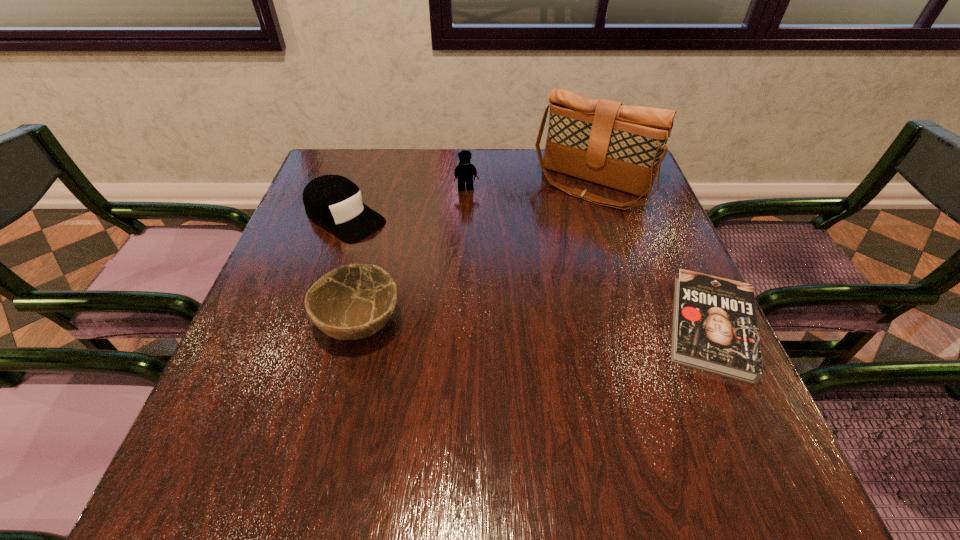
In the image, there is a desktop. Identify the location of vacant space at the left edge. This screenshot has height=540, width=960. (301, 318).

The image size is (960, 540). Find the location of `vacant space at the right edge`. vacant space at the right edge is located at coordinates (640, 225).

Image resolution: width=960 pixels, height=540 pixels. I want to click on free space at the far left corner of the desktop, so click(x=344, y=165).

In the image, there is a desktop. Where is `free region at the near left corner`? free region at the near left corner is located at coordinates (276, 424).

In the image, there is a desktop. At what (x,y) coordinates should I click in order to perform the action: click on blank space at the far right corner. Please return your answer as a coordinate pair (x, y). This screenshot has height=540, width=960. Looking at the image, I should click on (603, 195).

I want to click on unoccupied area between the third object from left to right and the book, so click(588, 258).

You are a GUI agent. You are given a task and a screenshot of the screen. Output one action in this format:
    pyautogui.click(x=<x>, y=<y>)
    Task: Click on the empty location between the tallest object and the shortest object
    
    Given the screenshot: What is the action you would take?
    pyautogui.click(x=651, y=256)

Locate an element on the screen. This screenshot has height=540, width=960. free area in between the book and the shoulder bag is located at coordinates (651, 256).

This screenshot has width=960, height=540. What are the coordinates of `free space between the cap and the book` in the screenshot? It's located at (528, 272).

You are a GUI agent. You are given a task and a screenshot of the screen. Output one action in this format:
    pyautogui.click(x=<x>, y=<y>)
    Task: Click on the free spot between the cap and the Lego
    This screenshot has height=540, width=960.
    Given the screenshot: What is the action you would take?
    pyautogui.click(x=406, y=204)